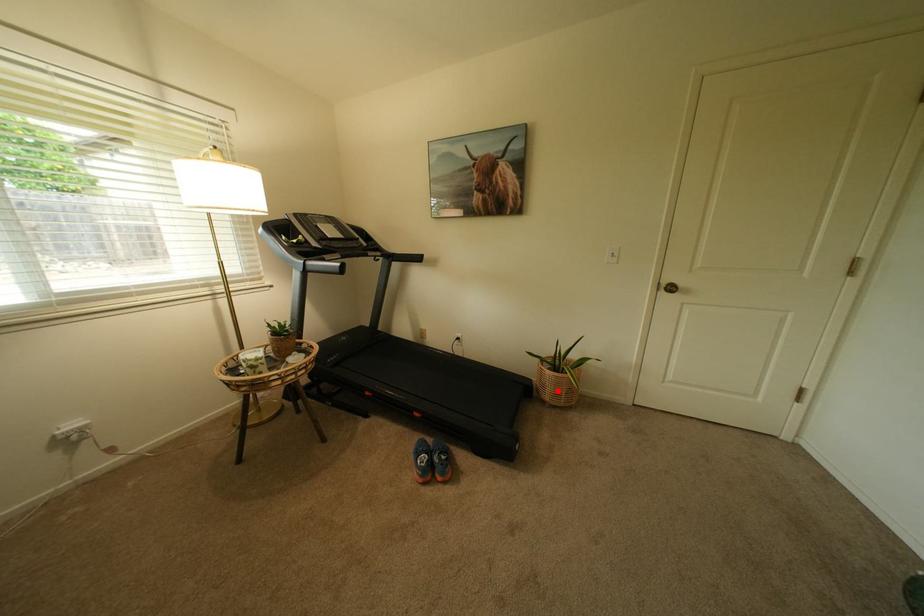
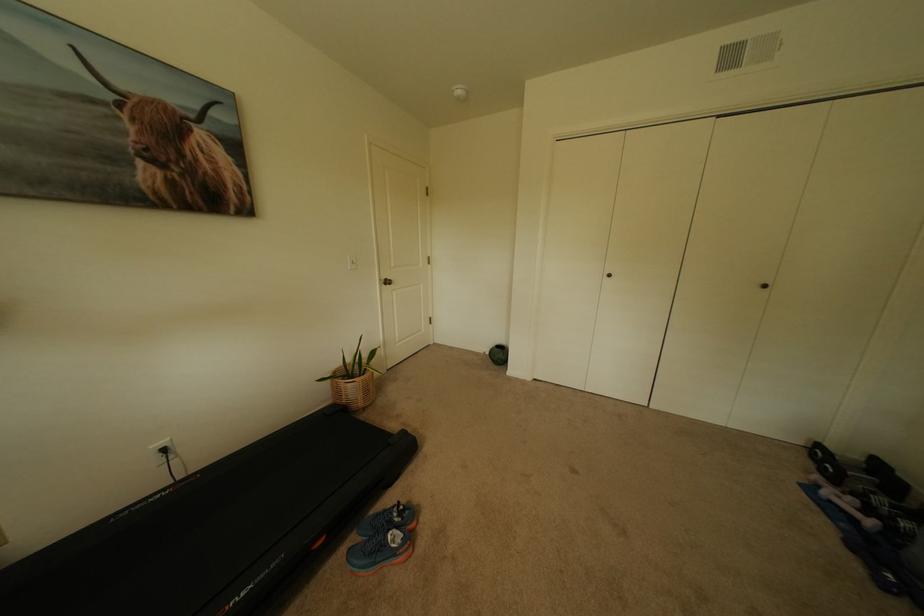
Question: A red point is marked in image1. In image2, is the corresponding 3D point closer to the camera or farther? Reply with the corresponding letter.

Choices:
 (A) The corresponding 3D point is closer.
 (B) The corresponding 3D point is farther.

Answer: (A)